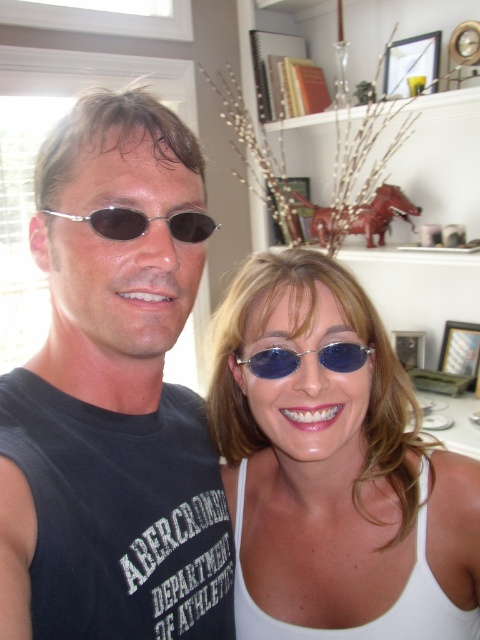
Question: In this image, where is satin white tank top at center located relative to blue metallic sunglasses at center?

Choices:
 (A) below
 (B) above

Answer: (A)

Question: Which point is closer to the camera taking this photo?

Choices:
 (A) (108, 230)
 (B) (342, 368)
 (C) (396, 449)
 (D) (105, 602)

Answer: (A)

Question: Can you confirm if matte black sunglasses at center is smaller than satin white tank top at center?

Choices:
 (A) yes
 (B) no

Answer: (B)

Question: Does satin white tank top at center appear under sunglasses at center?

Choices:
 (A) no
 (B) yes

Answer: (B)

Question: Which object appears farthest from the camera in this image?

Choices:
 (A) matte black sunglasses at center
 (B) satin white tank top at center
 (C) blue metallic sunglasses at center
 (D) sunglasses at center

Answer: (C)

Question: Which of the following is the farthest from the observer?

Choices:
 (A) (340, 371)
 (B) (109, 336)

Answer: (A)